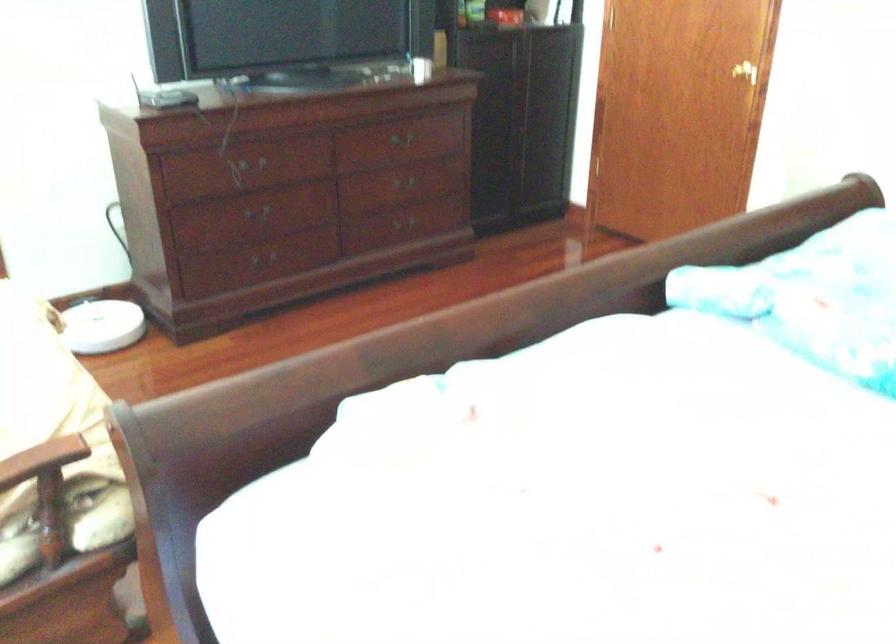
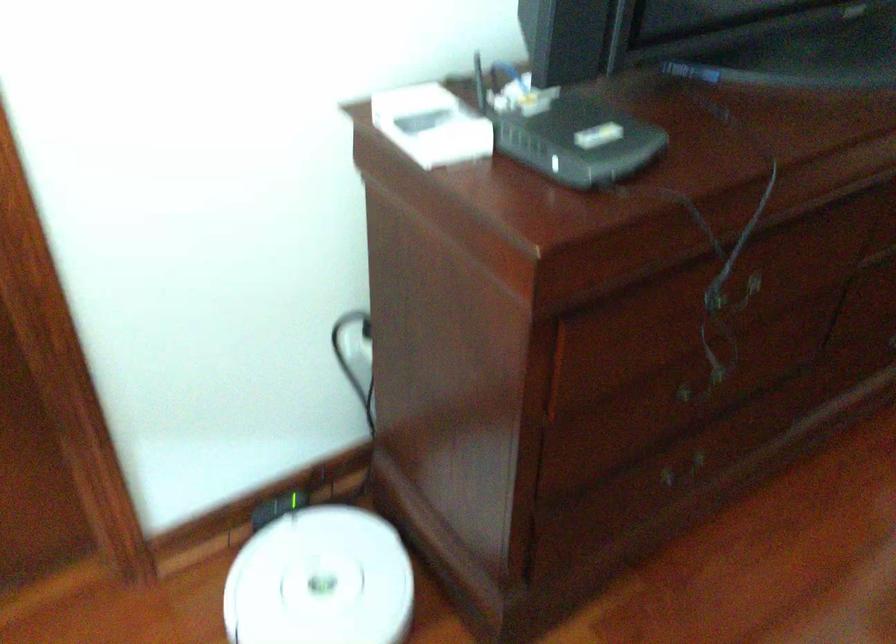
Where in the second image is the point corresponding to pixel 265 267 from the first image?

(684, 473)